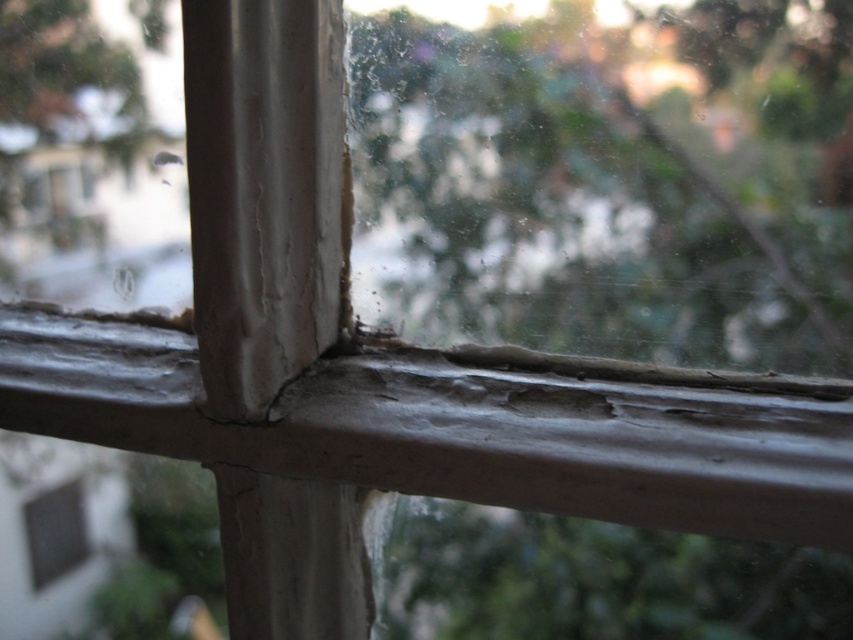
Which is more to the right, green leafy tree at center or matte gray window at lower left?

green leafy tree at center is more to the right.

Which of these two, green leafy tree at center or matte gray window at lower left, stands shorter?

With less height is matte gray window at lower left.

The width and height of the screenshot is (853, 640). What do you see at coordinates (614, 180) in the screenshot?
I see `green leafy tree at center` at bounding box center [614, 180].

Where is `green leafy tree at center`? Image resolution: width=853 pixels, height=640 pixels. green leafy tree at center is located at coordinates (614, 180).